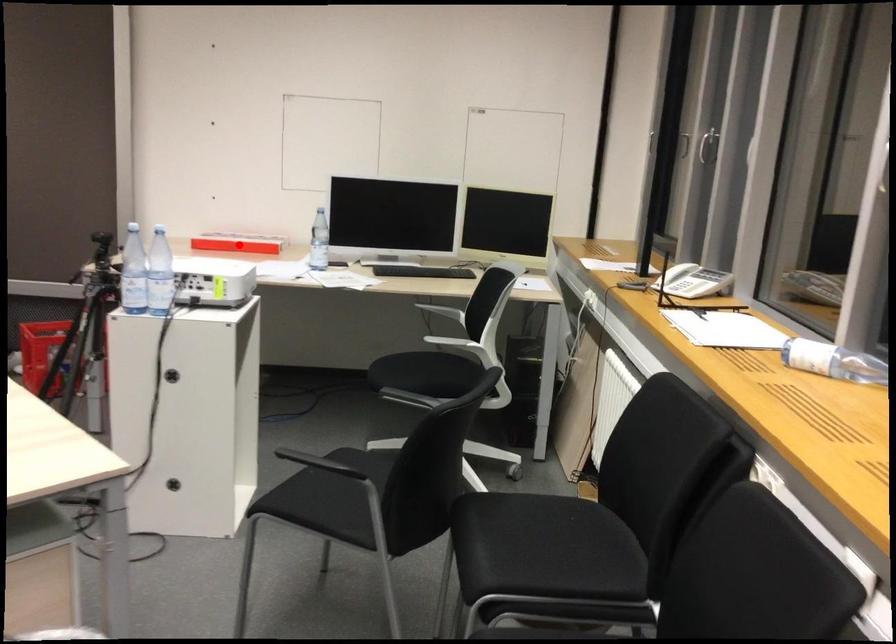
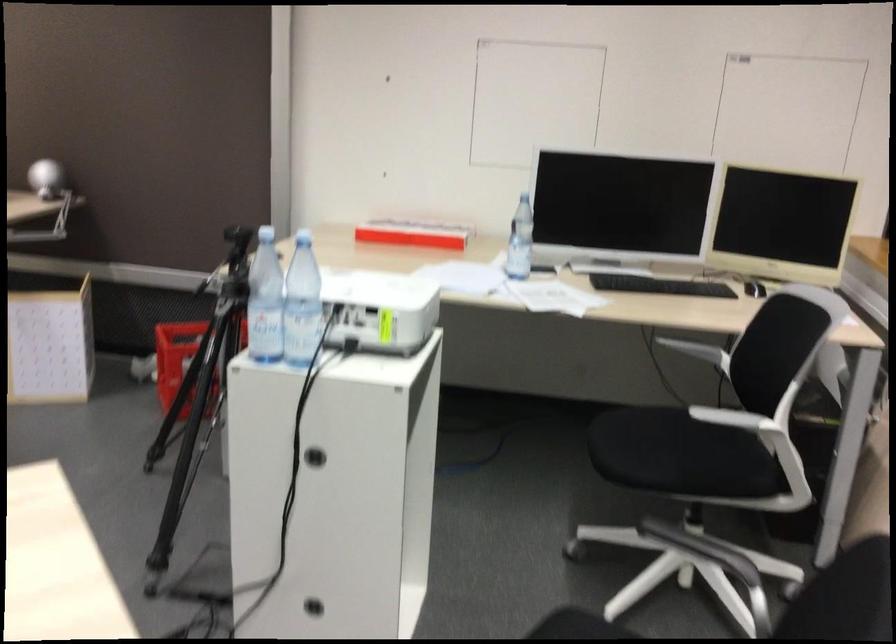
Locate, in the second image, the point that corresponds to the highlighted location in the first image.

(412, 234)